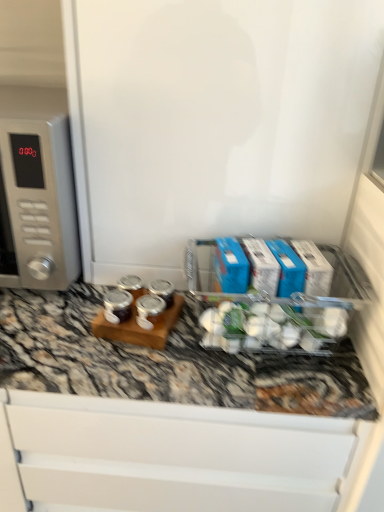
Question: Is satin silver microwave at left in contact with clear plastic container at center?

Choices:
 (A) yes
 (B) no

Answer: (B)

Question: Can you confirm if satin silver microwave at left is positioned to the right of clear plastic container at center?

Choices:
 (A) no
 (B) yes

Answer: (A)

Question: Can you confirm if satin silver microwave at left is positioned to the left of clear plastic container at center?

Choices:
 (A) no
 (B) yes

Answer: (B)

Question: Can we say satin silver microwave at left lies outside clear plastic container at center?

Choices:
 (A) yes
 (B) no

Answer: (A)

Question: Is satin silver microwave at left thinner than clear plastic container at center?

Choices:
 (A) no
 (B) yes

Answer: (A)

Question: Is clear plastic container at center at the back of satin silver microwave at left?

Choices:
 (A) no
 (B) yes

Answer: (A)

Question: From the image's perspective, is clear plastic container at center above satin silver microwave at left?

Choices:
 (A) no
 (B) yes

Answer: (A)

Question: Is satin silver microwave at left inside clear plastic container at center?

Choices:
 (A) yes
 (B) no

Answer: (B)

Question: Is clear plastic container at center thinner than satin silver microwave at left?

Choices:
 (A) no
 (B) yes

Answer: (B)

Question: Is clear plastic container at center taller than satin silver microwave at left?

Choices:
 (A) no
 (B) yes

Answer: (A)

Question: Is clear plastic container at center shorter than satin silver microwave at left?

Choices:
 (A) no
 (B) yes

Answer: (B)

Question: Does clear plastic container at center turn towards satin silver microwave at left?

Choices:
 (A) no
 (B) yes

Answer: (A)

Question: Which is correct: clear plastic container at center is inside satin silver microwave at left, or outside of it?

Choices:
 (A) outside
 (B) inside

Answer: (A)